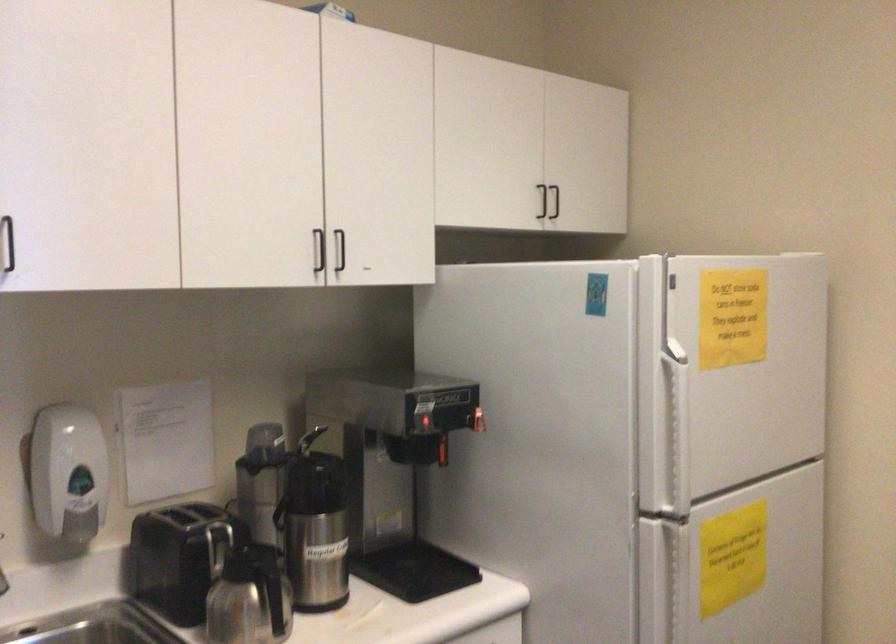
First-person continuous shooting, in which direction is the camera rotating?

The camera rotated toward right-down.